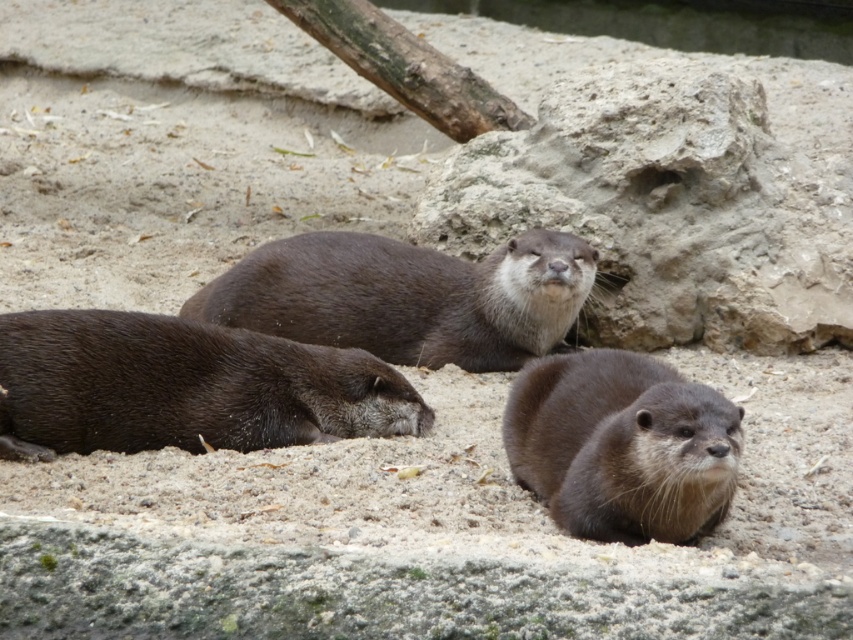
Question: Based on their relative distances, which object is nearer to the brown fur otter at center?

Choices:
 (A) brown furry otter at lower right
 (B) shiny brown otter at lower left

Answer: (B)

Question: Is brown fur otter at center in front of brown furry otter at lower right?

Choices:
 (A) yes
 (B) no

Answer: (B)

Question: Is brown fur otter at center closer to the viewer compared to brown furry otter at lower right?

Choices:
 (A) no
 (B) yes

Answer: (A)

Question: In this image, where is shiny brown otter at lower left located relative to brown fur otter at center?

Choices:
 (A) above
 (B) below

Answer: (B)

Question: Which point is closer to the camera taking this photo?

Choices:
 (A) (262, 312)
 (B) (149, 362)

Answer: (B)

Question: Among these points, which one is nearest to the camera?

Choices:
 (A) (616, 480)
 (B) (344, 356)
 (C) (529, 339)

Answer: (A)